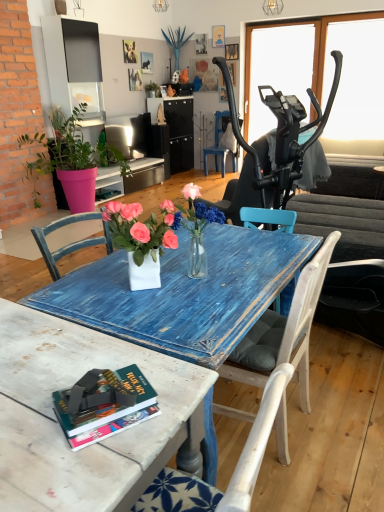
Question: Does green matte plant at upper center, acting as the first houseplant starting from the top, have a lesser width compared to white glossy vase at center?

Choices:
 (A) yes
 (B) no

Answer: (A)

Question: From a real-world perspective, is green matte plant at upper center, the second houseplant positioned from the front, on white glossy vase at center?

Choices:
 (A) no
 (B) yes

Answer: (B)

Question: Is white glossy vase at center at the back of green matte plant at upper center, acting as the first houseplant starting from the top?

Choices:
 (A) yes
 (B) no

Answer: (B)

Question: From a real-world perspective, is green matte plant at upper center, the second houseplant positioned from the front, located beneath white glossy vase at center?

Choices:
 (A) yes
 (B) no

Answer: (B)

Question: Can you confirm if green matte plant at upper center, marked as the 1th houseplant in a back-to-front arrangement, is positioned to the left of white glossy vase at center?

Choices:
 (A) no
 (B) yes

Answer: (B)

Question: From a real-world perspective, is hardcover book at lower left positioned above or below blue textured vase at upper center?

Choices:
 (A) above
 (B) below

Answer: (B)

Question: Looking at the image, does hardcover book at lower left seem bigger or smaller compared to blue textured vase at upper center?

Choices:
 (A) big
 (B) small

Answer: (B)

Question: Considering the positions of point (102, 373) and point (180, 33), is point (102, 373) closer or farther from the camera than point (180, 33)?

Choices:
 (A) farther
 (B) closer

Answer: (B)

Question: From the image's perspective, relative to blue textured vase at upper center, is hardcover book at lower left above or below?

Choices:
 (A) above
 (B) below

Answer: (B)

Question: Considering the positions of white painted wood chair at center, the 2th chair positioned from the top, and pink plastic pot at left, which is the first houseplant from front to back, in the image, is white painted wood chair at center, the 2th chair positioned from the top, wider or thinner than pink plastic pot at left, which is the first houseplant from front to back,?

Choices:
 (A) thin
 (B) wide

Answer: (A)

Question: Is point (306, 265) closer or farther from the camera than point (67, 185)?

Choices:
 (A) farther
 (B) closer

Answer: (B)

Question: Which is correct: white painted wood chair at center, the 2th chair positioned from the top, is inside pink plastic pot at left, which is the first houseplant from front to back, or outside of it?

Choices:
 (A) inside
 (B) outside

Answer: (B)

Question: In the image, is white painted wood chair at center, placed as the 1th chair when sorted from front to back, positioned in front of or behind pink plastic pot at left, which is counted as the 1th houseplant, starting from the bottom?

Choices:
 (A) behind
 (B) front

Answer: (B)

Question: Considering the positions of green matte plant at upper center, the second houseplant positioned from the front, and white painted wood chair at center, placed as the 1th chair when sorted from front to back, in the image, is green matte plant at upper center, the second houseplant positioned from the front, taller or shorter than white painted wood chair at center, placed as the 1th chair when sorted from front to back,?

Choices:
 (A) short
 (B) tall

Answer: (A)

Question: From the image's perspective, is green matte plant at upper center, the second houseplant positioned from the bottom, positioned above or below white painted wood chair at center, which is counted as the 1th chair, starting from the bottom?

Choices:
 (A) below
 (B) above

Answer: (B)